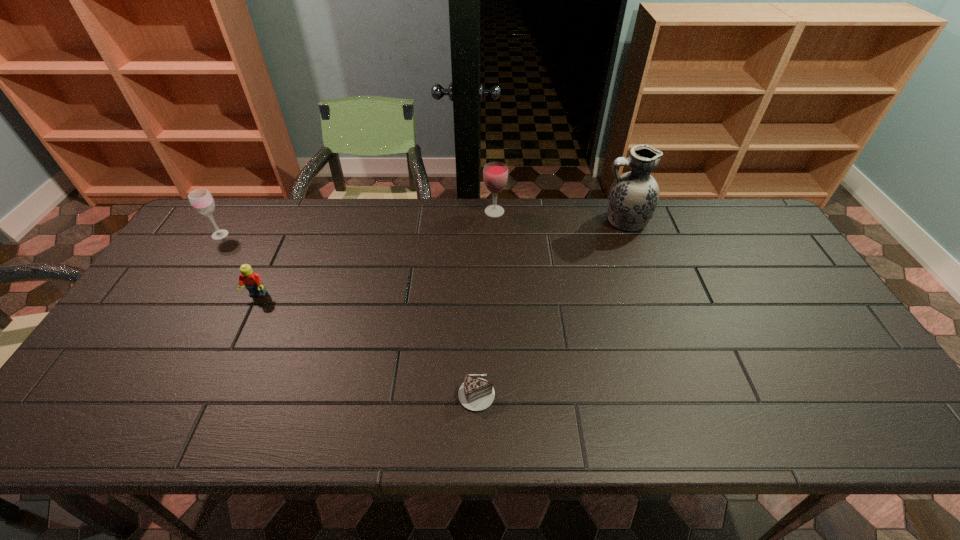
The image size is (960, 540). Identify the location of vacant space at the far edge. (414, 229).

Find the location of a particular element. The image size is (960, 540). free space at the near edge of the desktop is located at coordinates (481, 438).

Find the location of `vacant space at the left edge of the desktop`. vacant space at the left edge of the desktop is located at coordinates (141, 362).

You are a GUI agent. You are given a task and a screenshot of the screen. Output one action in this format:
    pyautogui.click(x=<x>, y=<y>)
    Task: Click on the vacant space at the right edge of the desktop
    This screenshot has height=540, width=960.
    Given the screenshot: What is the action you would take?
    pos(783,263)

Image resolution: width=960 pixels, height=540 pixels. I want to click on blank space at the near left corner of the desktop, so click(x=130, y=425).

Locate an element on the screen. The image size is (960, 540). vacant area that lies between the tallest object and the nearer wineglass is located at coordinates (422, 228).

Find the location of `vacant area that lies between the left wineglass and the tallest object`. vacant area that lies between the left wineglass and the tallest object is located at coordinates (422, 228).

In order to click on unoccupied area between the farther wineglass and the second object from left to right in this screenshot , I will do `click(376, 253)`.

Identify the location of free space between the nearer wineglass and the right wineglass. (357, 223).

What are the coordinates of `free area in between the nearer wineglass and the vase` in the screenshot? It's located at (422, 228).